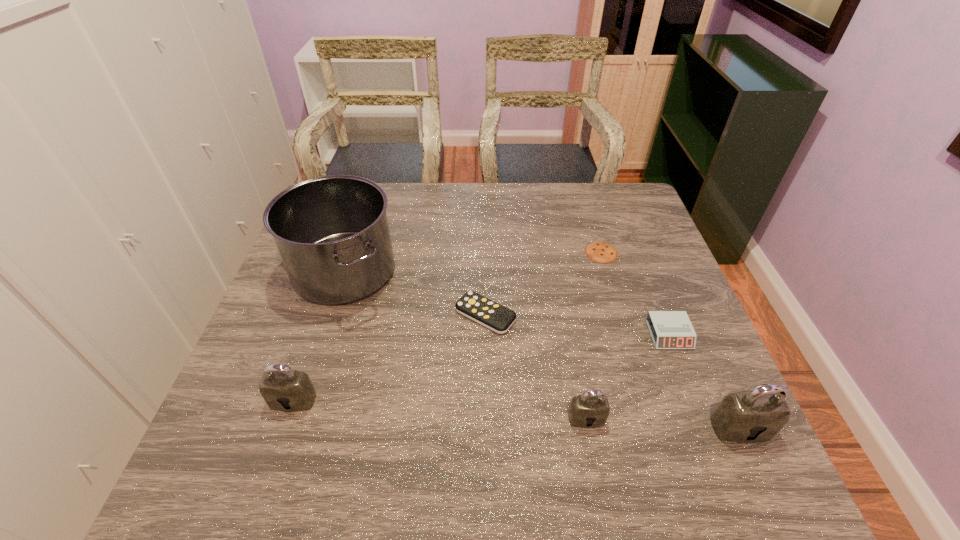
What are the coordinates of `object that is the sixth closest to the second tallest object` in the screenshot? It's located at (283, 389).

Locate which object is the sixth closest to the second tallest object. Please provide its 2D coordinates. Your answer should be formatted as a tuple, i.e. [(x, y)], where the tuple contains the x and y coordinates of a point satisfying the conditions above.

[(283, 389)]

Choose which padlock is the third nearest neighbor to the third object from right to left. Please provide its 2D coordinates. Your answer should be formatted as a tuple, i.e. [(x, y)], where the tuple contains the x and y coordinates of a point satisfying the conditions above.

[(283, 389)]

Locate which padlock ranks in proximity to the second padlock from right to left. Please provide its 2D coordinates. Your answer should be formatted as a tuple, i.e. [(x, y)], where the tuple contains the x and y coordinates of a point satisfying the conditions above.

[(757, 415)]

Identify the location of free space that satisfies the following two spatial constraints: 1. on the front side of the remote control; 2. on the right side of the saucepan. Image resolution: width=960 pixels, height=540 pixels. coord(331,315).